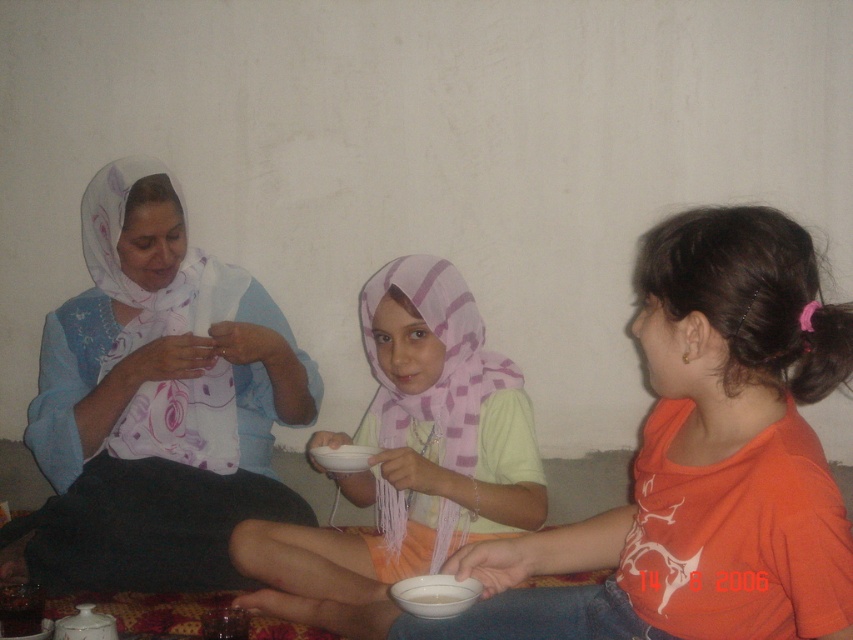
Question: Is matte white scarf at left closer to camera compared to white matte bowl at center?

Choices:
 (A) no
 (B) yes

Answer: (A)

Question: Which object is closer to the camera taking this photo?

Choices:
 (A) matte pink scarf at center
 (B) light green fabric hijab at center
 (C) matte white scarf at left

Answer: (A)

Question: Among these objects, which one is farthest from the camera?

Choices:
 (A) white matte bowl at center
 (B) matte pink scarf at center

Answer: (A)

Question: Among these points, which one is farthest from the camera?

Choices:
 (A) (434, 600)
 (B) (368, 481)
 (C) (251, 460)

Answer: (C)

Question: Considering the relative positions of matte white scarf at left and white matte bowl at center in the image provided, where is matte white scarf at left located with respect to white matte bowl at center?

Choices:
 (A) left
 (B) right

Answer: (A)

Question: Does matte white scarf at left have a smaller size compared to white matte bowl at center?

Choices:
 (A) yes
 (B) no

Answer: (B)